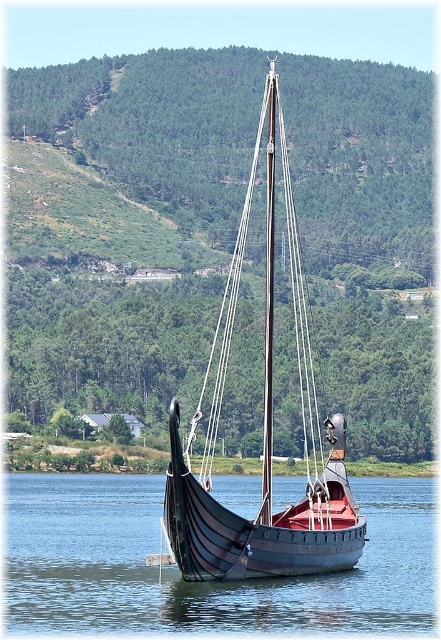
Question: Is smooth blue water at center to the left of black wood sailboat at center from the viewer's perspective?

Choices:
 (A) no
 (B) yes

Answer: (B)

Question: Considering the real-world distances, which object is farthest from the smooth blue water at center?

Choices:
 (A) black wood sailboat at center
 (B) green forested hillside at upper center

Answer: (B)

Question: Is green forested hillside at upper center positioned behind black wood sailboat at center?

Choices:
 (A) yes
 (B) no

Answer: (A)

Question: Which object is positioned farthest from the green forested hillside at upper center?

Choices:
 (A) black wood sailboat at center
 (B) smooth blue water at center

Answer: (B)

Question: Based on their relative distances, which object is nearer to the black wood sailboat at center?

Choices:
 (A) smooth blue water at center
 (B) green forested hillside at upper center

Answer: (A)

Question: From the image, what is the correct spatial relationship of smooth blue water at center in relation to black wood sailboat at center?

Choices:
 (A) left
 (B) right

Answer: (A)